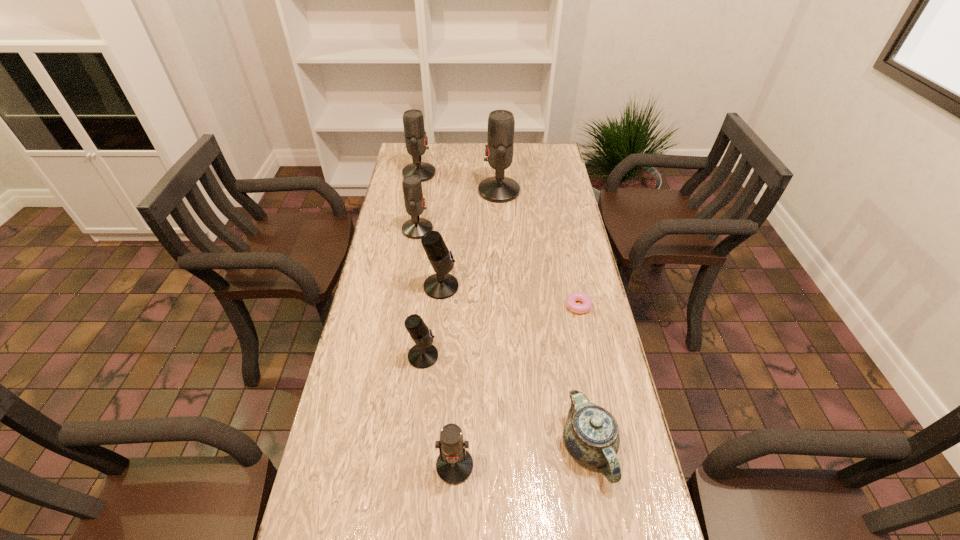
The width and height of the screenshot is (960, 540). What are the coordinates of `free region located on the side of the third biggest red microphone with the red ring` in the screenshot? It's located at (516, 230).

Locate an element on the screen. Image resolution: width=960 pixels, height=540 pixels. vacant space situated 0.360m on the stand of the fifth farthest microphone is located at coordinates coord(567,356).

Where is `vacant space located 0.060m from the spout of the chinaware`? The image size is (960, 540). vacant space located 0.060m from the spout of the chinaware is located at coordinates (601, 521).

At what (x,y) coordinates should I click in order to perform the action: click on vacant position located on the front of the shortest object. Please return your answer as a coordinate pair (x, y). Looking at the image, I should click on (591, 385).

Find the location of a particular element. The width and height of the screenshot is (960, 540). object that is positioned at the far edge is located at coordinates (413, 121).

You are a GUI agent. You are given a task and a screenshot of the screen. Output one action in this format:
    pyautogui.click(x=<x>, y=<y>)
    Task: Click on the chinaware located in the right edge section of the desktop
    The height and width of the screenshot is (540, 960).
    Given the screenshot: What is the action you would take?
    pyautogui.click(x=591, y=435)

The image size is (960, 540). Find the location of `doughnut positioned at the right edge`. doughnut positioned at the right edge is located at coordinates (571, 300).

This screenshot has height=540, width=960. I want to click on object present at the far left corner, so point(413,121).

In the image, there is a desktop. Identify the location of vacant space at the far edge. click(481, 155).

Image resolution: width=960 pixels, height=540 pixels. Identify the location of vacant space at the left edge of the desktop. (406, 215).